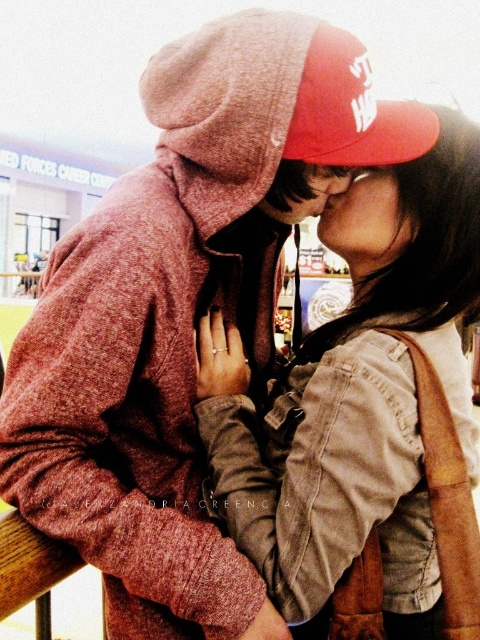
Question: Which point is farther from the camera taking this photo?

Choices:
 (A) (214, 384)
 (B) (314, 60)

Answer: (A)

Question: Is matte brown jacket at center further to the viewer compared to red cotton baseball cap at upper center?

Choices:
 (A) no
 (B) yes

Answer: (B)

Question: Is matte brown jacket at center to the left of red cotton baseball cap at upper center from the viewer's perspective?

Choices:
 (A) no
 (B) yes

Answer: (A)

Question: Is matte brown jacket at center bigger than red cotton baseball cap at upper center?

Choices:
 (A) yes
 (B) no

Answer: (A)

Question: Which point is closer to the camera?

Choices:
 (A) matte brown jacket at center
 (B) red cotton baseball cap at upper center

Answer: (B)

Question: Which of the following is the closest to the observer?

Choices:
 (A) red cotton baseball cap at upper center
 (B) matte brown jacket at center

Answer: (A)